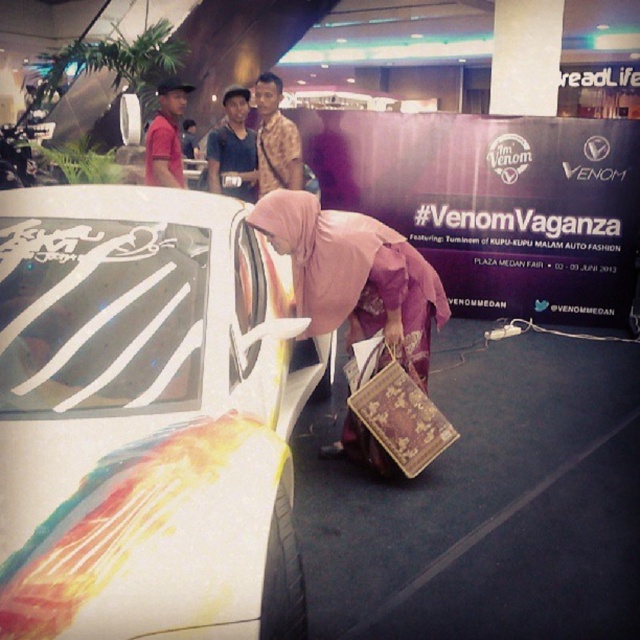
You are a photographer at the VenomVaganza event and need to position a spotlight exactly at the center of the matte blue shirt at upper center. According to the coordinates provided, where should you aim the spotlight?

The spotlight should be aimed at the coordinates point (232, 148) to hit the center of the matte blue shirt at upper center.

You are a photographer at the event and need to position yourself between the shiny metallic car at center and the camouflage fabric shirt at center to take a photo. Given that the minimum distance required for your camera to focus is 9 feet, will you be able to capture both objects clearly in the same frame?

The distance between the shiny metallic car at center and the camouflage fabric shirt at center is 8.50 feet, which is less than the camera focus requirement of 9 feet. Therefore, you will not be able to capture both objects clearly in the same frame.

You are at the VenomVaganza event and want to take a photo with both the shiny metallic car at center and the pink fabric hijab at center in the background. Is the car positioned in front of the hijab?

Yes, the shiny metallic car at center is in front of the pink fabric hijab at center, so you can take a photo with the car in the foreground and the hijab visible in the background.